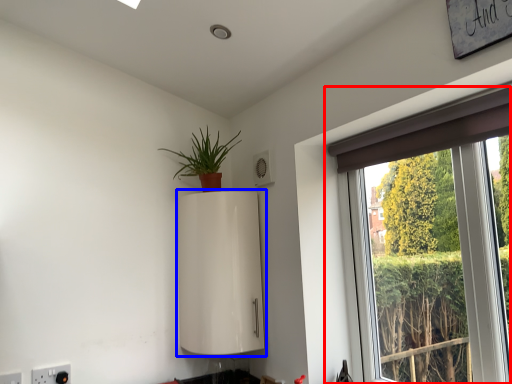
Question: Which object is further to the camera taking this photo, window (highlighted by a red box) or appliance (highlighted by a blue box)?

Choices:
 (A) window
 (B) appliance

Answer: (B)